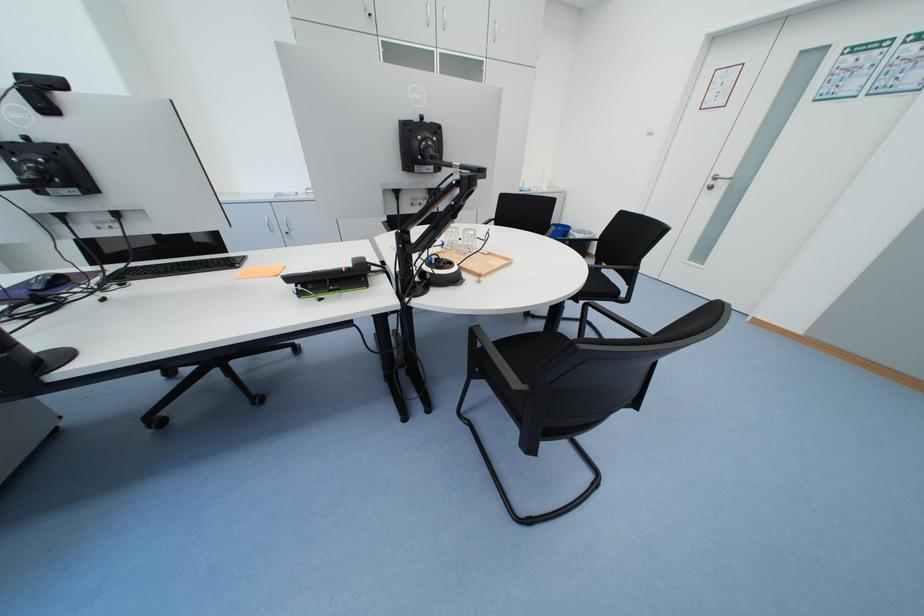
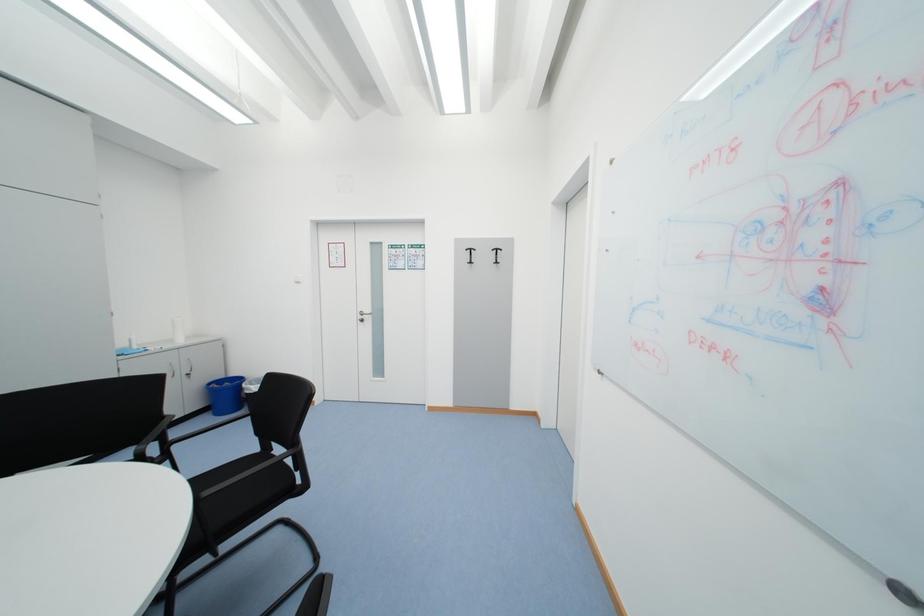
Question: How did the camera likely rotate?

Choices:
 (A) Left
 (B) Right
 (C) Up
 (D) Down

Answer: (B)